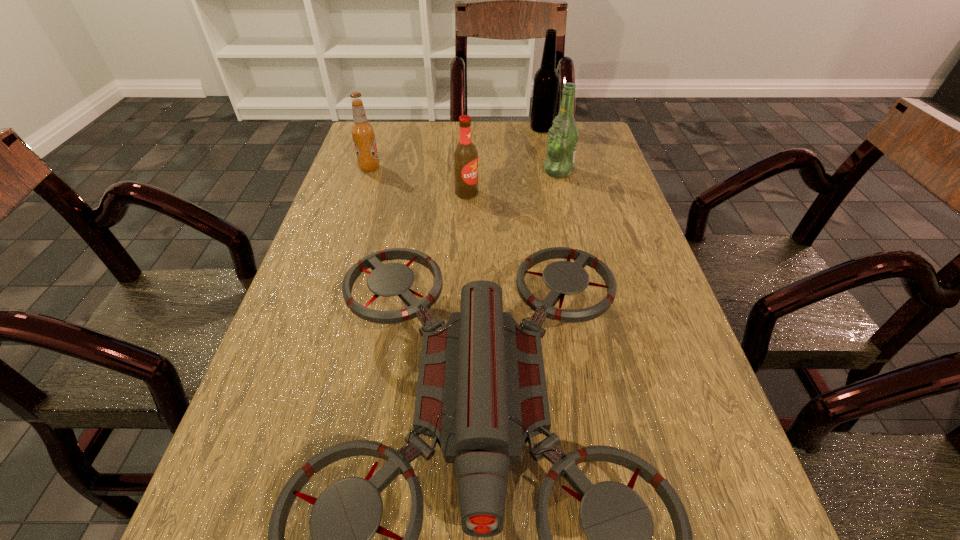
Locate an element on the screen. This screenshot has width=960, height=540. the farthest beer bottle is located at coordinates (546, 80).

At what (x,y) coordinates should I click in order to perform the action: click on the farthest object. Please return your answer as a coordinate pair (x, y). The image size is (960, 540). Looking at the image, I should click on (546, 80).

The width and height of the screenshot is (960, 540). Identify the location of the leftmost object. (362, 132).

Where is `the third beer bottle from right to left`? The height and width of the screenshot is (540, 960). the third beer bottle from right to left is located at coordinates (465, 156).

Locate an element on the screen. This screenshot has width=960, height=540. the nearest beer bottle is located at coordinates (465, 156).

Locate an element on the screen. Image resolution: width=960 pixels, height=540 pixels. vacant space located 0.340m on the left of the tallest beer bottle is located at coordinates (420, 129).

Find the location of a particular element. The width and height of the screenshot is (960, 540). free location located on the front label of the leftmost object is located at coordinates pos(420,167).

Identify the location of free space located 0.170m on the right of the third beer bottle from right to left. The height and width of the screenshot is (540, 960). (545, 193).

Where is `object situated at the far edge`? The height and width of the screenshot is (540, 960). object situated at the far edge is located at coordinates pyautogui.click(x=546, y=80).

Where is `object situated at the left edge`? This screenshot has height=540, width=960. object situated at the left edge is located at coordinates (362, 132).